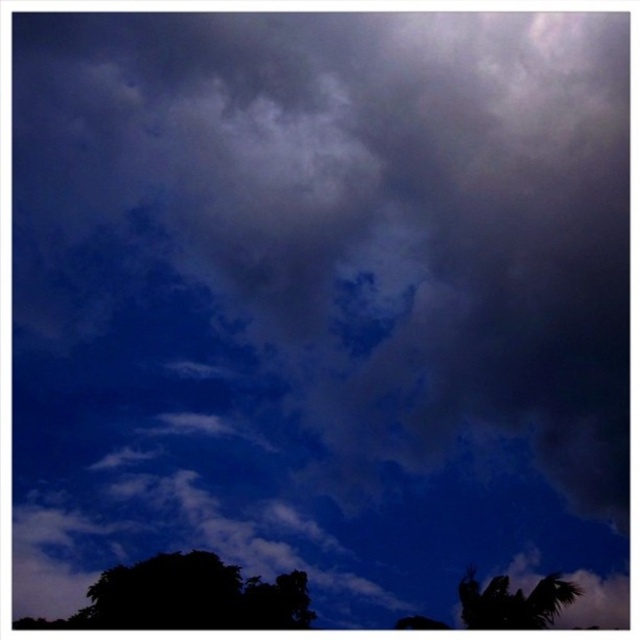
Question: In this image, where is silhouette leafy tree at lower left located relative to silhouette leafy palm at bottom right?

Choices:
 (A) left
 (B) right

Answer: (A)

Question: Among these points, which one is farthest from the camera?

Choices:
 (A) tap(547, 612)
 (B) tap(188, 573)

Answer: (B)

Question: Can you confirm if silhouette leafy tree at lower left is thinner than silhouette leafy palm at bottom right?

Choices:
 (A) no
 (B) yes

Answer: (A)

Question: Can you confirm if silhouette leafy tree at lower left is smaller than silhouette leafy palm at bottom right?

Choices:
 (A) no
 (B) yes

Answer: (A)